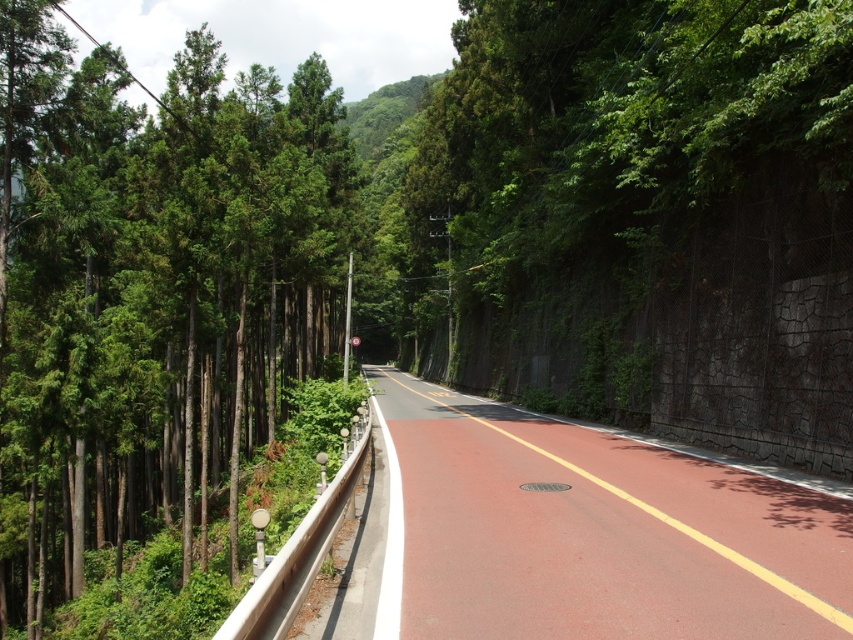
Can you confirm if green textured trees at left is taller than smooth asphalt road at center?

Yes, green textured trees at left is taller than smooth asphalt road at center.

Does green textured trees at left have a greater width compared to smooth asphalt road at center?

Yes, green textured trees at left is wider than smooth asphalt road at center.

Is point (9, 8) positioned before point (564, 605)?

No, it is behind (564, 605).

Find the location of a particular element. This screenshot has height=640, width=853. green textured trees at left is located at coordinates (149, 292).